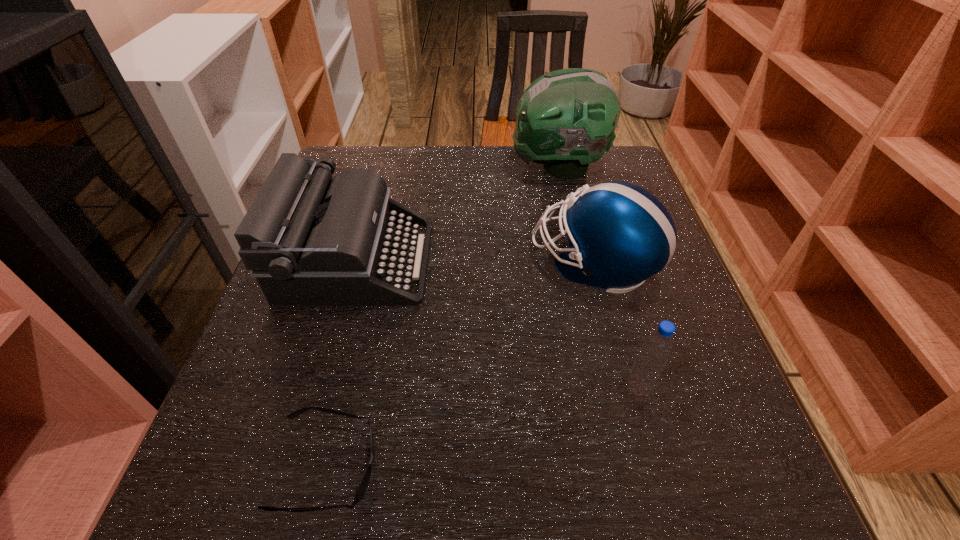
You are a GUI agent. You are given a task and a screenshot of the screen. Output one action in this format:
    pyautogui.click(x=<x>, y=<y>)
    Task: Click on the free space located 0.210m at the front of the nearer football helmet with the faceguard
    
    Given the screenshot: What is the action you would take?
    pyautogui.click(x=434, y=264)

Identify the location of vacant area located at the front of the nearer football helmet with the faceguard. The image size is (960, 540). (467, 264).

Identify the location of vacant area located at the front of the nearer football helmet with the faceguard. (406, 264).

Identify the location of vacant point located 0.080m on the typing side of the typewriter. This screenshot has height=540, width=960. 466,260.

The height and width of the screenshot is (540, 960). Identify the location of vacant space located on the back of the fourth farthest object. (605, 268).

Locate an element on the screen. Image resolution: width=960 pixels, height=540 pixels. free point located on the lenses of the sunglasses is located at coordinates (534, 467).

In order to click on object situated at the far edge in this screenshot , I will do `click(566, 119)`.

Locate an element on the screen. Image resolution: width=960 pixels, height=540 pixels. object at the near edge is located at coordinates (363, 484).

Identify the location of typewriter that is at the left edge. (309, 239).

This screenshot has height=540, width=960. Find the location of `sunglasses positioned at the left edge`. sunglasses positioned at the left edge is located at coordinates (363, 484).